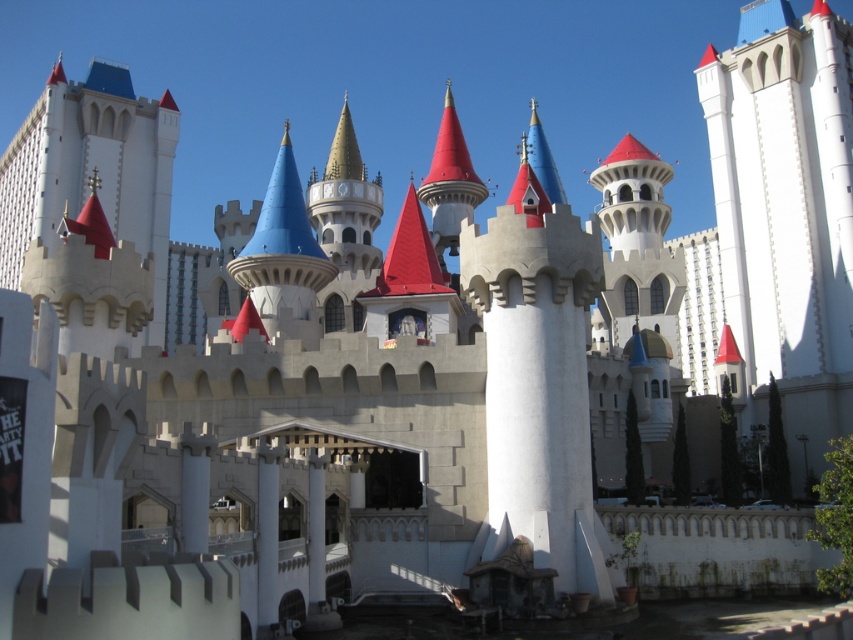
You are standing at the entrance of the castle and want to locate the white stone tower at upper right. Based on the coordinates provided, in which direction should you look to see it?

The white stone tower at upper right is located at coordinates point (786, 212), so you should look towards the upper right direction to see it.

You are an architect designing a scale model of the castle. You have two pieces of material for the white stone tower at upper right and the white stone castle at upper left. Given that the materials have the same thickness, which piece requires a larger amount of material to construct?

The white stone tower at upper right requires a larger amount of material because it is larger in size than the white stone castle at upper left.

You are standing in front of the castle structure and want to take a photo of both the white stone tower at upper right and the white stone castle at upper left. Which object should you focus on first if you want to capture both in a single frame without moving the camera?

You should focus on the white stone castle at upper left first because the white stone tower at upper right is positioned below it, so adjusting the camera to include the lower tower might require a wider angle or repositioning, but since they are both at the upper parts, ensuring the upper castle is framed properly would naturally include the lower tower within the same frame.